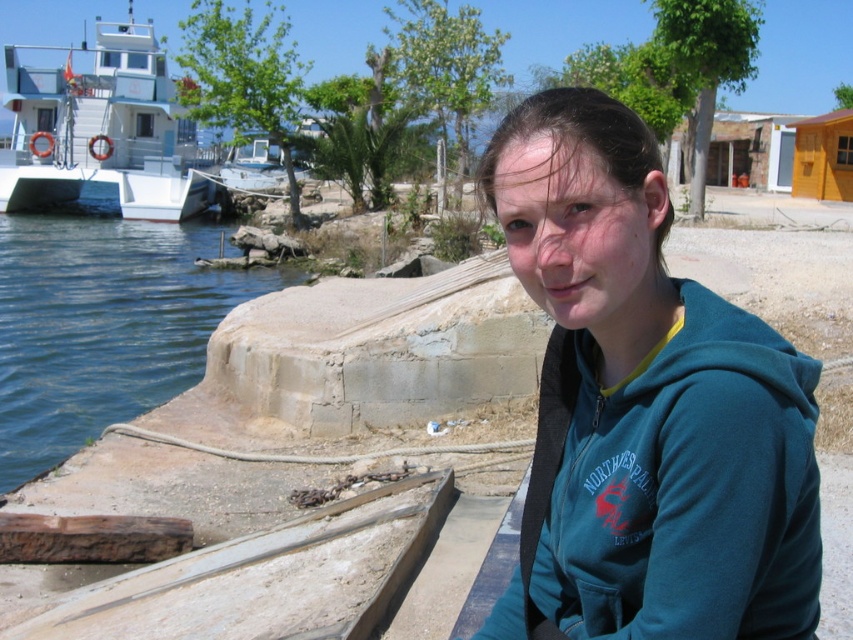
Who is more distant from viewer, (254, 272) or (79, 77)?

The point (79, 77) is behind.

Find the location of a particular element. This screenshot has height=640, width=853. blue water at lower left is located at coordinates [103, 324].

You are a GUI agent. You are given a task and a screenshot of the screen. Output one action in this format:
    pyautogui.click(x=<x>, y=<y>)
    Task: Click on the blue water at lower left
    Image resolution: width=853 pixels, height=640 pixels.
    Given the screenshot: What is the action you would take?
    pyautogui.click(x=103, y=324)

Does teal fleece jacket at center have a smaller size compared to blue water at lower left?

Correct, teal fleece jacket at center occupies less space than blue water at lower left.

Does teal fleece jacket at center have a lesser width compared to blue water at lower left?

Yes.

Between point (782, 410) and point (56, 259), which one is positioned in front?

Point (782, 410) is in front.

The height and width of the screenshot is (640, 853). I want to click on teal fleece jacket at center, so click(x=645, y=406).

Is teal fleece jacket at center taller than white glossy boat at upper left?

In fact, teal fleece jacket at center may be shorter than white glossy boat at upper left.

Who is more distant from viewer, [625,342] or [74,168]?

The point [74,168] is behind.

Between point (630, 627) and point (28, 134), which one is positioned in front?

Point (630, 627)

Find the location of `teal fleece jacket at center`. teal fleece jacket at center is located at coordinates (645, 406).